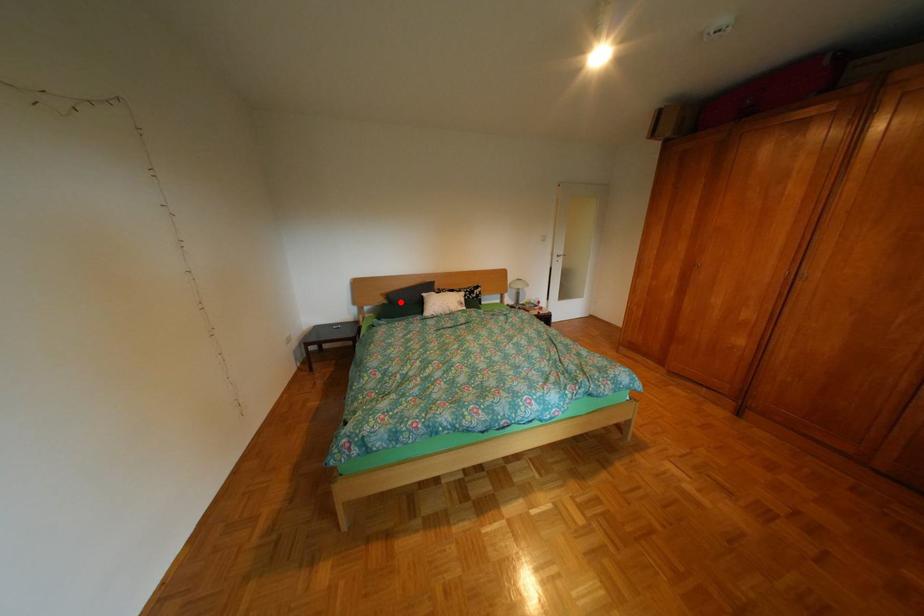
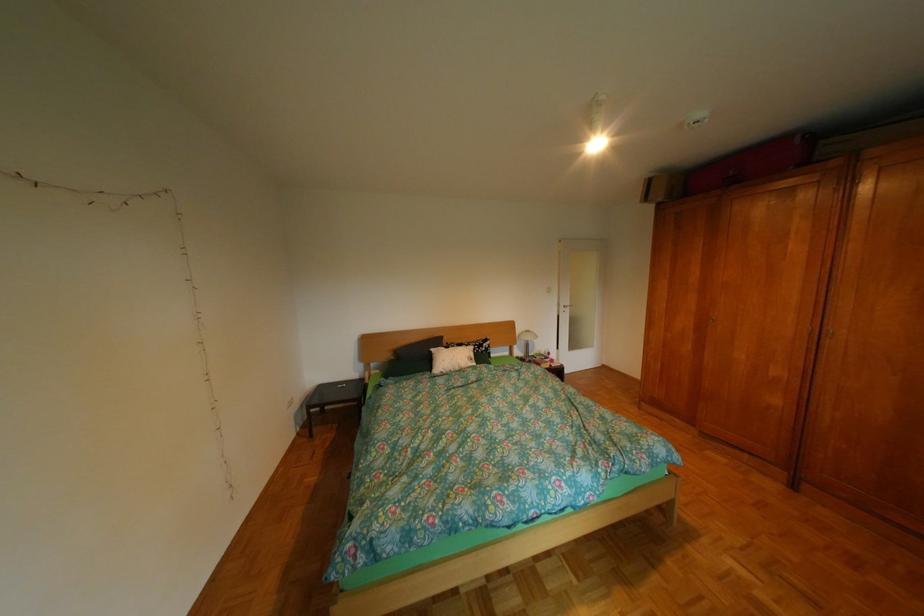
Locate, in the second image, the point that corresponds to the highlighted location in the first image.

(407, 359)